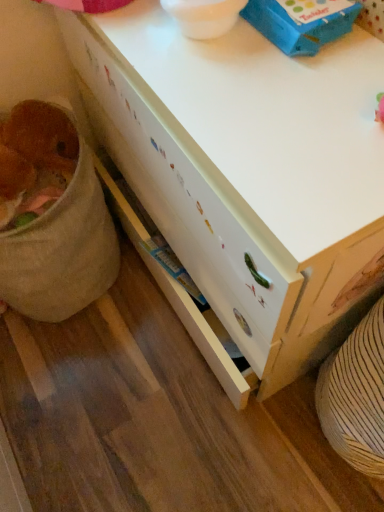
At what (x,y) coordinates should I click in order to perform the action: click on free space in front of blue cardboard box at upper center. Please return your answer as a coordinate pair (x, y). Looking at the image, I should click on (292, 106).